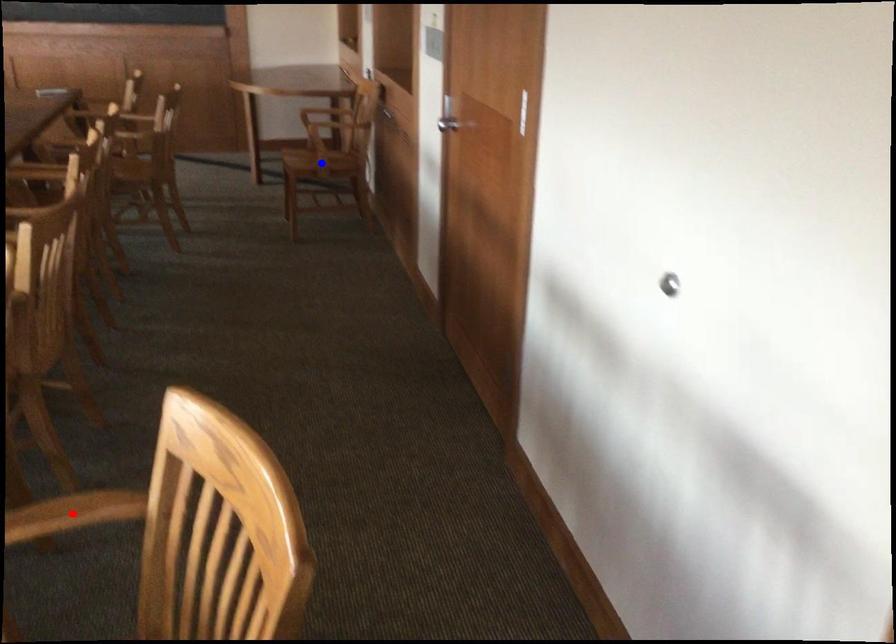
Question: Two points are marked on the image. Which point is closer to the camera?

Choices:
 (A) Blue point is closer.
 (B) Red point is closer.

Answer: (B)